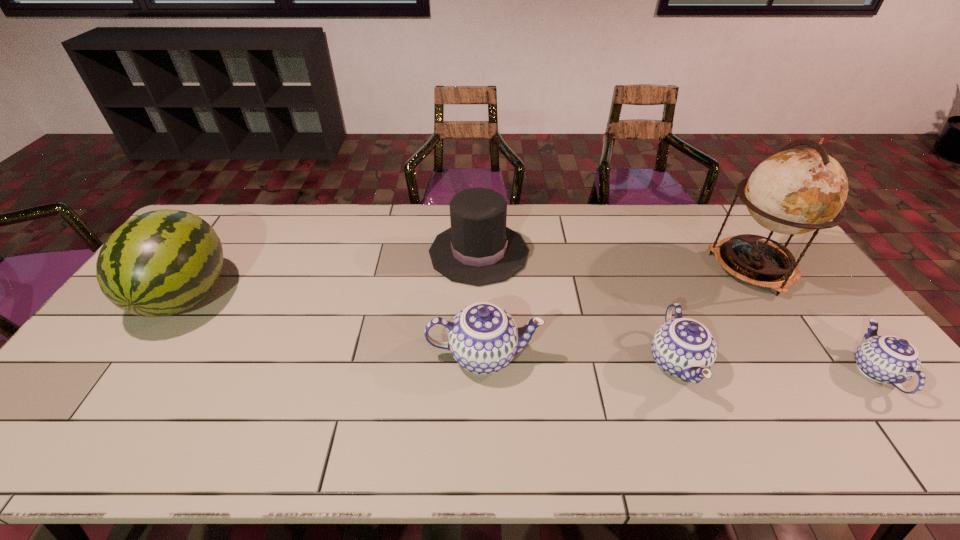
Image resolution: width=960 pixels, height=540 pixels. I want to click on vacant area that lies between the tallest object and the leftmost chinaware, so click(618, 312).

Identify the location of vacant area between the globe and the third object from right to left. The height and width of the screenshot is (540, 960). click(x=715, y=315).

This screenshot has width=960, height=540. In order to click on free point between the tallest chinaware and the globe in this screenshot , I will do `click(618, 312)`.

The width and height of the screenshot is (960, 540). In order to click on object that is the second nearest to the tallest chinaware in this screenshot , I will do (682, 347).

Locate which object ranks fourth in proximity to the globe. Please provide its 2D coordinates. Your answer should be formatted as a tuple, i.e. [(x, y)], where the tuple contains the x and y coordinates of a point satisfying the conditions above.

[(483, 338)]

At what (x,y) coordinates should I click in order to perform the action: click on chinaware that is the closest to the second shortest object. Please return your answer as a coordinate pair (x, y). This screenshot has width=960, height=540. Looking at the image, I should click on (483, 338).

Choose which chinaware is the second nearest neighbor to the tallest chinaware. Please provide its 2D coordinates. Your answer should be formatted as a tuple, i.e. [(x, y)], where the tuple contains the x and y coordinates of a point satisfying the conditions above.

[(889, 359)]

Where is `free region that satisfies the following two spatial constraints: 1. at the center of the tallest object; 2. at the spout of the tallest chinaware`? free region that satisfies the following two spatial constraints: 1. at the center of the tallest object; 2. at the spout of the tallest chinaware is located at coordinates (813, 355).

This screenshot has width=960, height=540. Find the location of `free space that satisfies the following two spatial constraints: 1. at the spout of the rightmost chinaware; 2. on the front of the dress hat with the decoration`. free space that satisfies the following two spatial constraints: 1. at the spout of the rightmost chinaware; 2. on the front of the dress hat with the decoration is located at coordinates (783, 253).

At what (x,y) coordinates should I click in order to perform the action: click on vacant space that satisfies the following two spatial constraints: 1. at the spout of the shortest chinaware; 2. at the spout of the tallest chinaware. Please return your answer as a coordinate pair (x, y). Looking at the image, I should click on (863, 355).